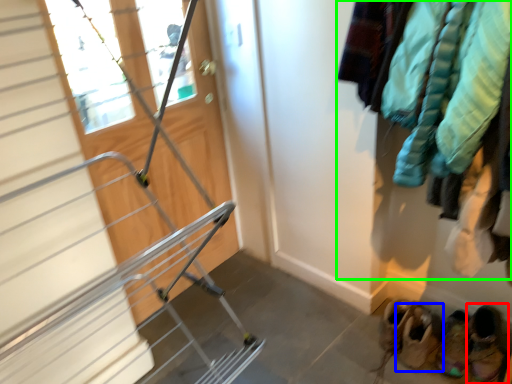
Question: Estimate the real-world distances between objects in this image. Which object is closer to footwear (highlighted by a red box), footwear (highlighted by a blue box) or clothing (highlighted by a green box)?

Choices:
 (A) footwear
 (B) clothing

Answer: (A)